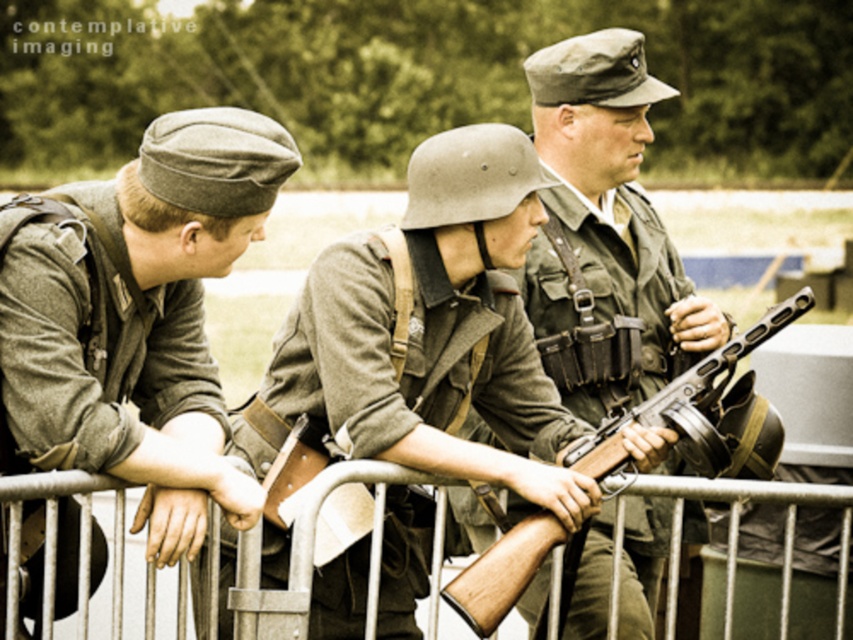
You are a costume designer preparing for a historical play. You have two uniforms labeled as matte green uniform at left and matte green uniform at center. Based on the scene description, which uniform should you choose for an actor who needs a larger size?

The matte green uniform at left has a larger size compared to matte green uniform at center, so you should choose the matte green uniform at left for the actor who needs a larger size.

You are a photographer trying to capture a group photo of the three individuals in the image. The camera you are using has a focus point set at coordinates point (137, 317). Which person will be in focus?

The point (137, 317) corresponds to the matte green uniform at left, so the person in the matte green uniform at left will be in focus.

You are a photographer trying to capture a group photo of the matte green uniform at center and the metallic silver fence at center. Based on their heights, which object should you adjust your camera angle to focus on first?

The matte green uniform at center is shorter than the metallic silver fence at center, so you should adjust your camera angle to focus on the metallic silver fence at center first to ensure both are in frame.